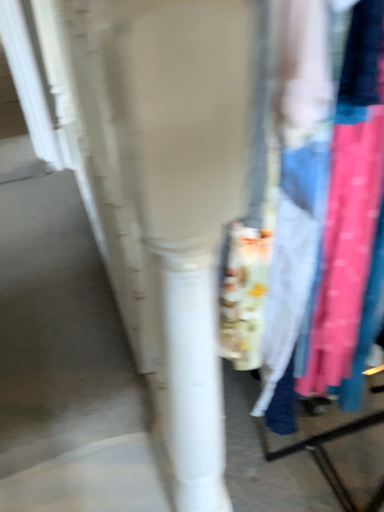
This screenshot has height=512, width=384. Identify the location of matte fabric at center. (329, 242).

Describe the element at coordinates (329, 242) in the screenshot. The height and width of the screenshot is (512, 384). I see `matte fabric at center` at that location.

Where is `matte fabric at center`? This screenshot has width=384, height=512. matte fabric at center is located at coordinates (329, 242).